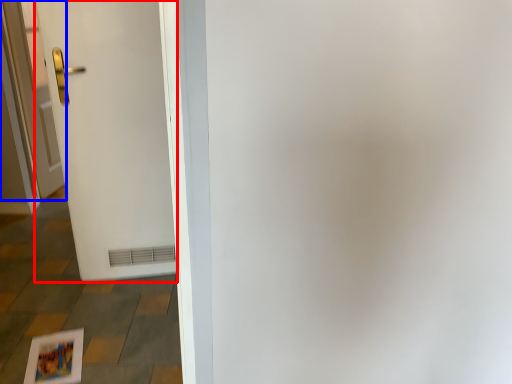
Question: Which point is closer to the camera, door (highlighted by a red box) or door (highlighted by a blue box)?

Choices:
 (A) door
 (B) door

Answer: (A)